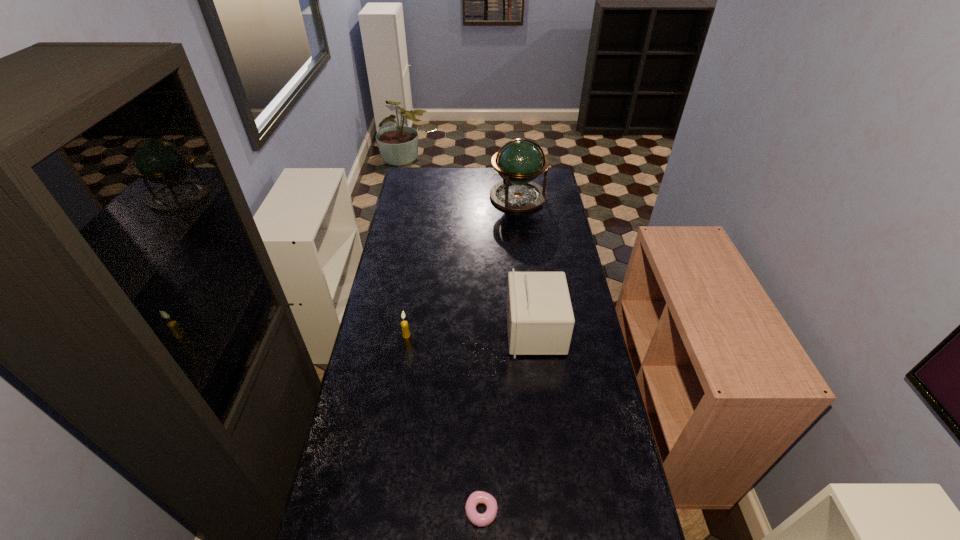
Find the location of `free space at the right edge of the desktop`. free space at the right edge of the desktop is located at coordinates (540, 247).

You are a GUI agent. You are given a task and a screenshot of the screen. Output one action in this format:
    pyautogui.click(x=<x>, y=<y>)
    Task: Click on the vacant area that lies between the second tallest object and the tallest object
    
    Given the screenshot: What is the action you would take?
    pyautogui.click(x=526, y=264)

Identify the location of vacant space in between the tallest object and the second tallest object. (526, 264).

The width and height of the screenshot is (960, 540). What are the coordinates of `free spot between the candle and the shortest object` in the screenshot? It's located at (444, 423).

Locate an element on the screen. free spot between the farthest object and the doughnut is located at coordinates (499, 354).

This screenshot has height=540, width=960. In order to click on free space between the doughnut and the candle in this screenshot , I will do `click(444, 423)`.

At what (x,y) coordinates should I click in order to perform the action: click on empty location between the first-aid kit and the tallest object. Please return your answer as a coordinate pair (x, y). Image resolution: width=960 pixels, height=540 pixels. Looking at the image, I should click on (526, 264).

Find the location of `free space between the globe and the first-aid kit`. free space between the globe and the first-aid kit is located at coordinates (526, 264).

The image size is (960, 540). In order to click on free area in between the candle and the second tallest object in this screenshot , I will do `click(470, 333)`.

Find the location of a particular element. Image resolution: width=960 pixels, height=540 pixels. vacant region between the doughnut and the farthest object is located at coordinates (499, 354).